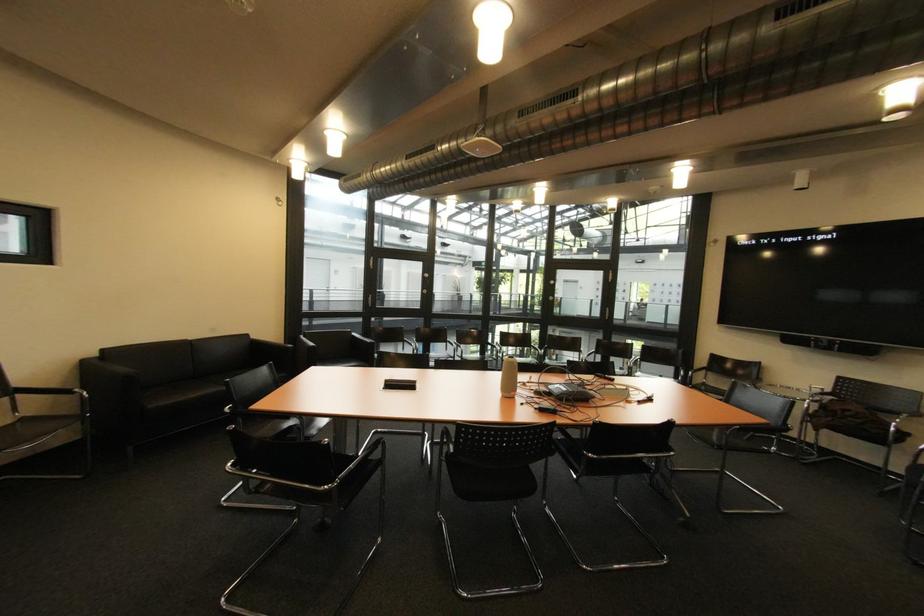
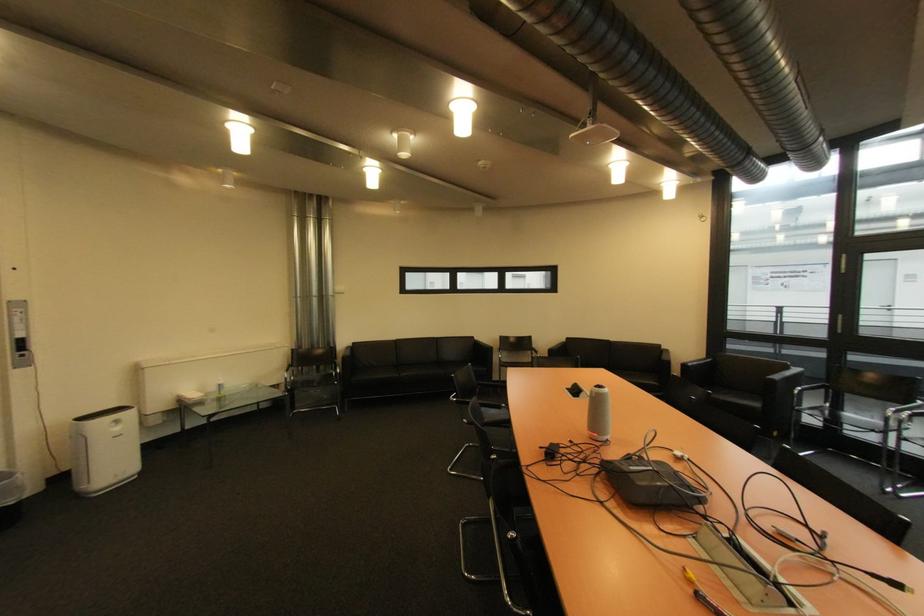
Question: I am providing you with two images of the same scene from different viewpoints. Which of the following objects are not visible in image2?

Choices:
 (A) black trash can
 (B) sofa sitting surface
 (C) sofa armrest
 (D) none of these

Answer: (D)